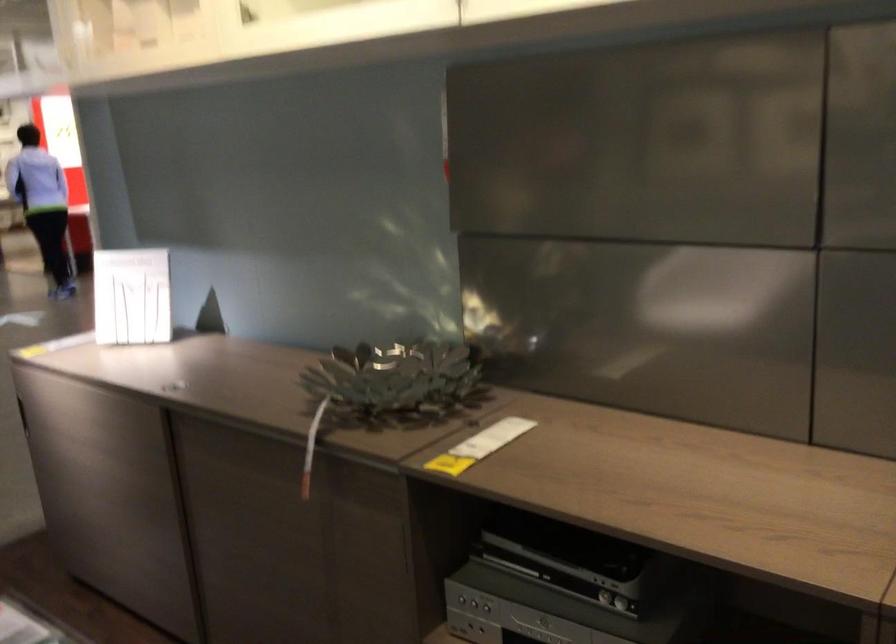
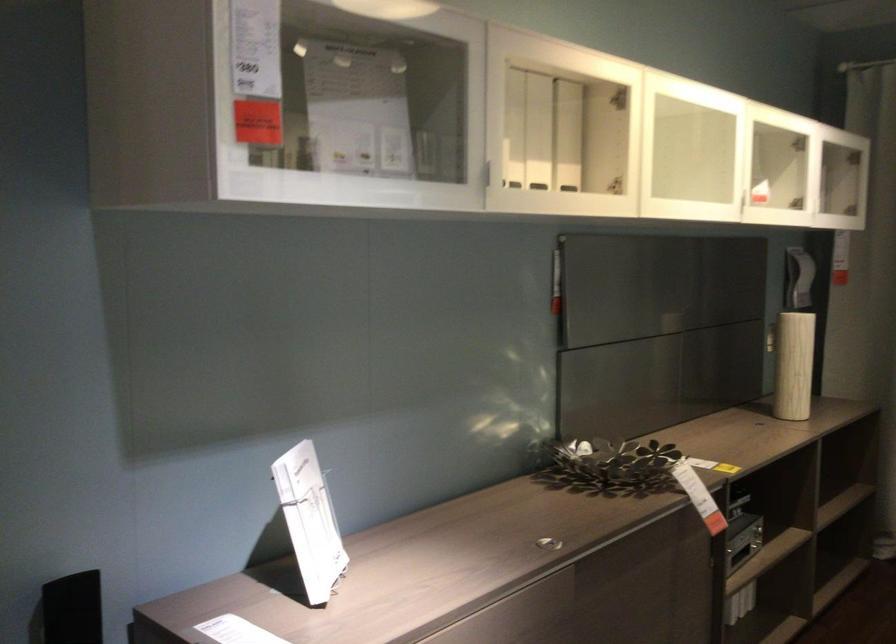
In the second image, find the point that corresponds to the point at 197,386 in the first image.

(547, 543)